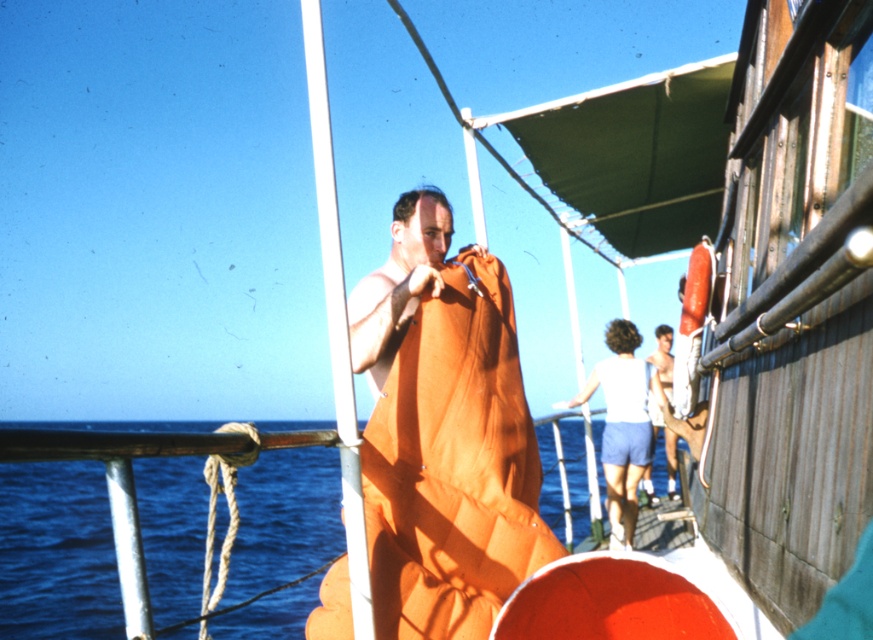
Between orange mesh fabric at center and blue water at lower left, which one appears on the right side from the viewer's perspective?

From the viewer's perspective, orange mesh fabric at center appears more on the right side.

Find the location of `orange mesh fabric at center`. orange mesh fabric at center is located at coordinates (443, 433).

Who is shorter, blue water at lower left or white fabric at center?

white fabric at center is shorter.

Describe the element at coordinates (56, 552) in the screenshot. The width and height of the screenshot is (873, 640). I see `blue water at lower left` at that location.

In order to click on blue water at lower left in this screenshot , I will do `click(56, 552)`.

Is orange mesh fabric at center thinner than white fabric at center?

In fact, orange mesh fabric at center might be wider than white fabric at center.

Is point (432, 401) closer to viewer compared to point (600, 376)?

Yes, it is in front of point (600, 376).

This screenshot has width=873, height=640. What do you see at coordinates (443, 433) in the screenshot?
I see `orange mesh fabric at center` at bounding box center [443, 433].

The width and height of the screenshot is (873, 640). Find the location of `orange mesh fabric at center`. orange mesh fabric at center is located at coordinates (443, 433).